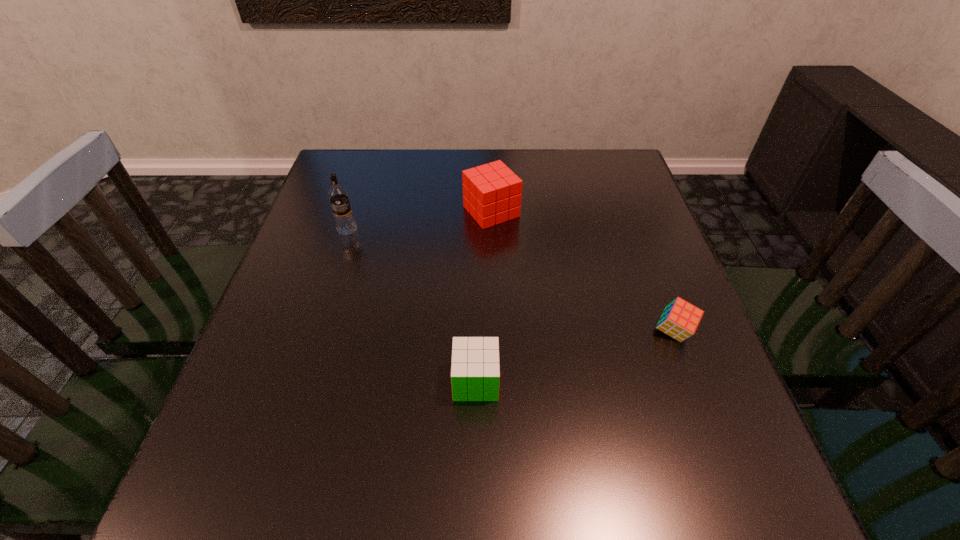
The width and height of the screenshot is (960, 540). I want to click on vacant space that's between the vodka and the nearest object, so click(x=412, y=305).

The width and height of the screenshot is (960, 540). I want to click on free space that is in between the tallest object and the farthest cube, so click(x=420, y=220).

Where is `vacant area between the second nearest cube and the vodka`? Image resolution: width=960 pixels, height=540 pixels. vacant area between the second nearest cube and the vodka is located at coordinates (511, 281).

The image size is (960, 540). I want to click on vacant area that lies between the nearest object and the second nearest cube, so (575, 356).

You are a GUI agent. You are given a task and a screenshot of the screen. Output one action in this format:
    pyautogui.click(x=<x>, y=<y>)
    Task: Click on the free area in between the farthest cube and the vodka
    The width and height of the screenshot is (960, 540).
    Given the screenshot: What is the action you would take?
    pyautogui.click(x=420, y=220)

Identify the location of empty location between the rightmost cube and the nearest object. The image size is (960, 540). (575, 356).

Locate an element on the screen. The image size is (960, 540). vacant space that's between the nearest cube and the vodka is located at coordinates (412, 305).

Find the location of `vacant space that is in between the nearest cube and the third farthest object`. vacant space that is in between the nearest cube and the third farthest object is located at coordinates (575, 356).

Locate an element on the screen. empty space between the leftmost object and the nearest object is located at coordinates (412, 305).

In order to click on vacant area between the rightmost object and the second tallest object in this screenshot , I will do `click(583, 272)`.